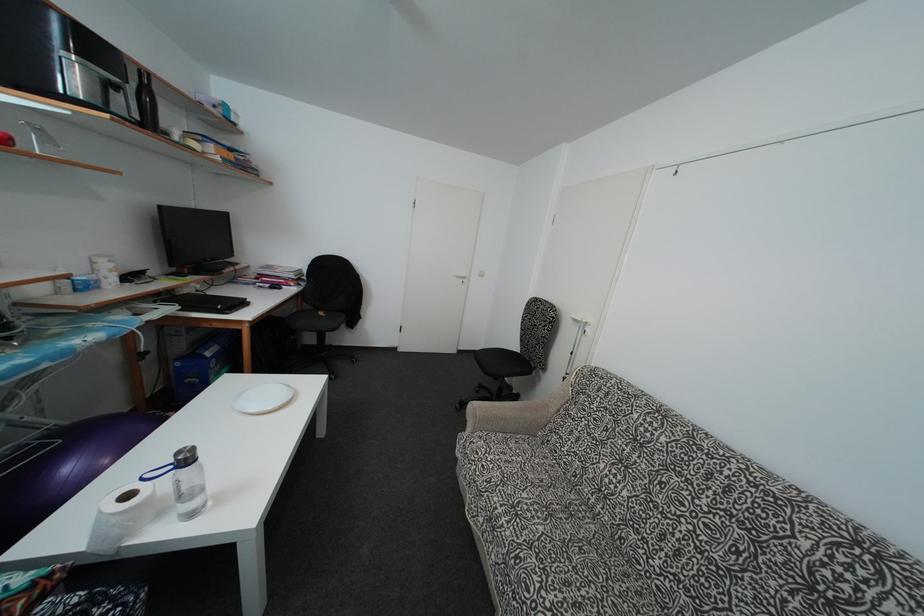
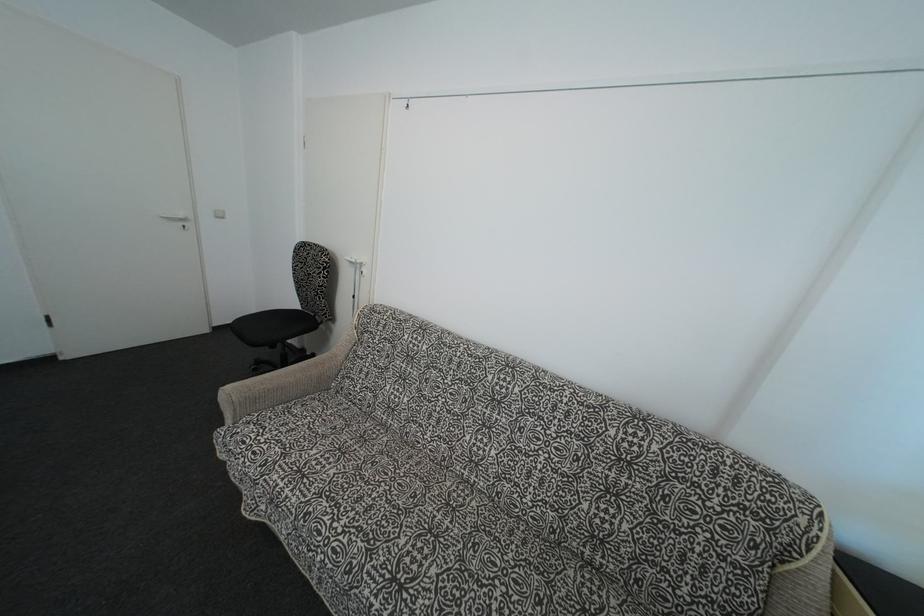
Find the pixel in the second image that matches [468,284] in the first image.

(188, 227)